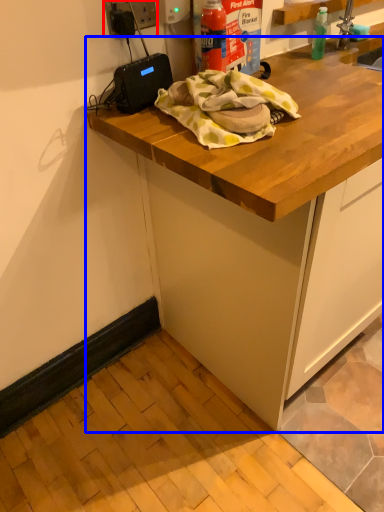
Question: Which object appears closest to the camera in this image, electric outlet (highlighted by a red box) or cabinetry (highlighted by a blue box)?

Choices:
 (A) electric outlet
 (B) cabinetry

Answer: (B)